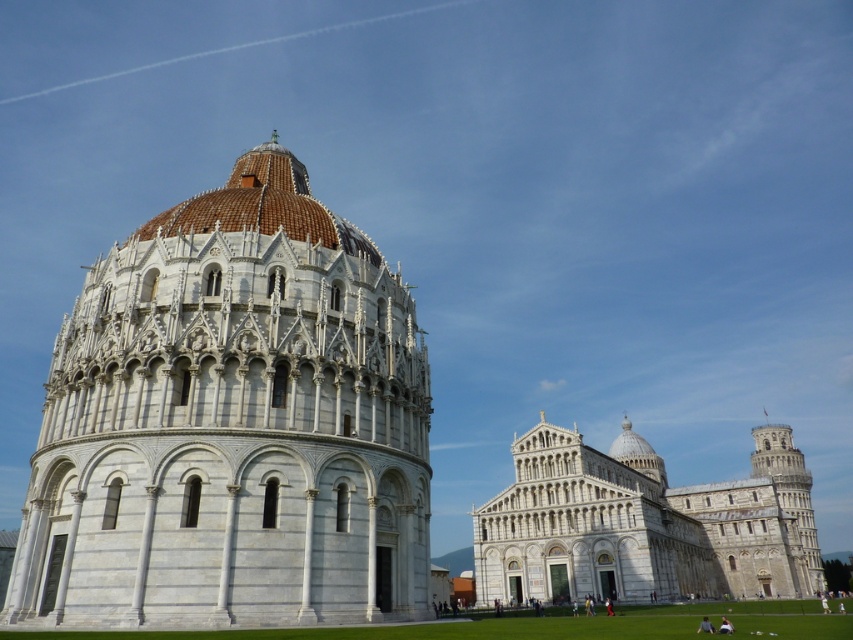
Can you confirm if white marble tower at center is taller than white stone cathedral at center?

Incorrect, white marble tower at center's height is not larger of white stone cathedral at center's.

Locate an element on the screen. Image resolution: width=853 pixels, height=640 pixels. white marble tower at center is located at coordinates (231, 424).